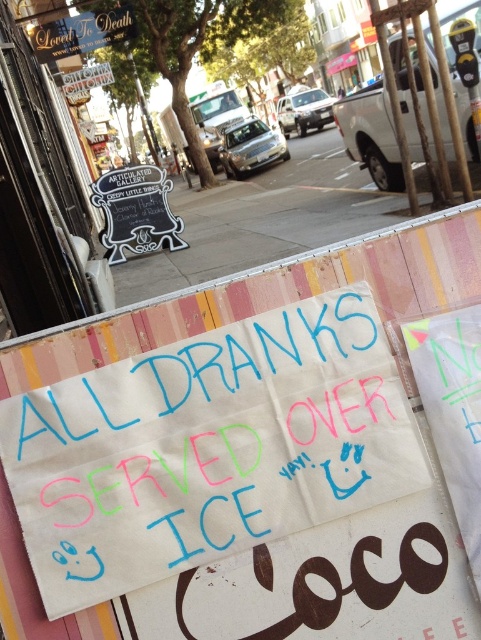
Consider the image. You are a delivery person trying to read the main sign on the street. From your position, which object is closer to you between the white paper sign at center and the concrete sidewalk at center?

The white paper sign at center is closer to you because it is in front of the concrete sidewalk at center.

Consider the image. You are a delivery person who needs to deliver a package to the address on the white paper sign at center. You see a point marked at coordinate (236, 477). Is this point located on the white paper sign at center?

Yes, the point (236, 477) is on the white paper sign at center, so the package should be delivered there.

You are a delivery robot that is 3 feet wide. You need to navigate from the white paper sign at center to the concrete sidewalk at center. Can you fit through the space between them?

The white paper sign at center and concrete sidewalk at center are 9.94 feet apart from each other, so yes, the robot can fit through the space between them since it is wider than the robot.